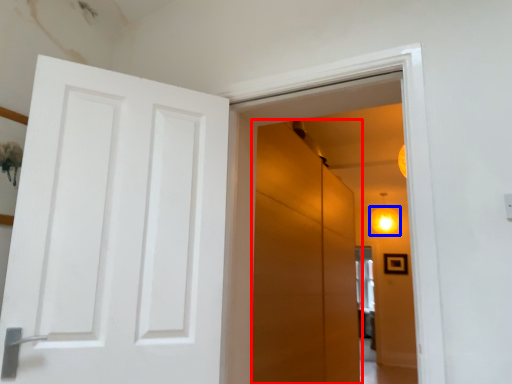
Question: Which of the following is the farthest to the observer, screen door (highlighted by a red box) or lighting (highlighted by a blue box)?

Choices:
 (A) screen door
 (B) lighting

Answer: (B)